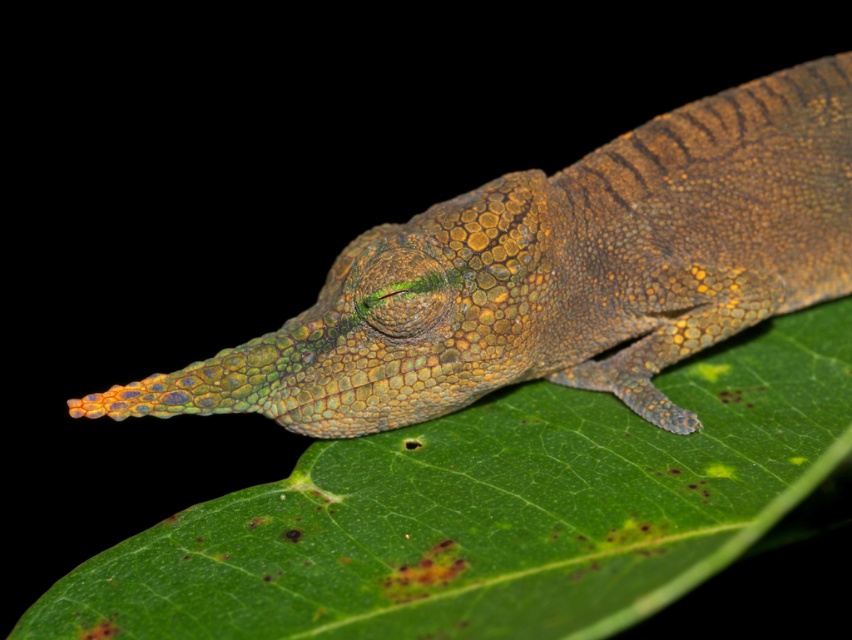
You are a photographer trying to capture a clear image of the green scaly lizard at center. Since the green matte leaf at center is blocking part of the lizard, will adjusting your camera focus to the leaf allow you to see the lizard clearly?

The green matte leaf at center is closer to the viewer than the green scaly lizard at center, so focusing on the leaf will not allow you to see the lizard clearly because it is farther away and will be out of focus.

You are an observer looking at the image. The scene shows a green matte leaf at center and a green scaly lizard at center. Which object is located below the other?

The green matte leaf at center is positioned under the green scaly lizard at center.